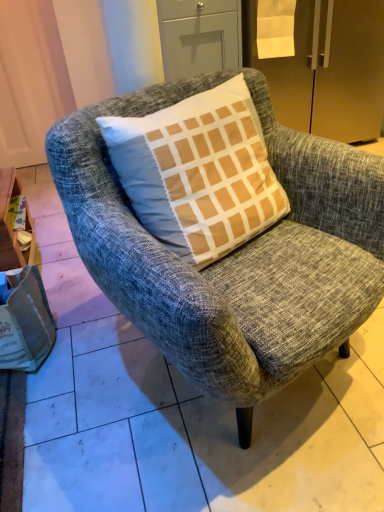
Question: From a real-world perspective, relative to textured gray armchair at center, is wooden at left vertically above or below?

Choices:
 (A) above
 (B) below

Answer: (B)

Question: From the image's perspective, is wooden at left located above or below textured gray armchair at center?

Choices:
 (A) above
 (B) below

Answer: (A)

Question: Based on their relative distances, which object is farther from the wooden at left?

Choices:
 (A) satin gold refrigerator at upper right
 (B) textured gray armchair at center
 (C) white paper bag at lower left
 (D) matte gray drawer at upper center

Answer: (A)

Question: Estimate the real-world distances between objects in this image. Which object is closer to the satin gold refrigerator at upper right?

Choices:
 (A) matte gray drawer at upper center
 (B) wooden at left
 (C) textured gray armchair at center
 (D) white paper bag at lower left

Answer: (A)